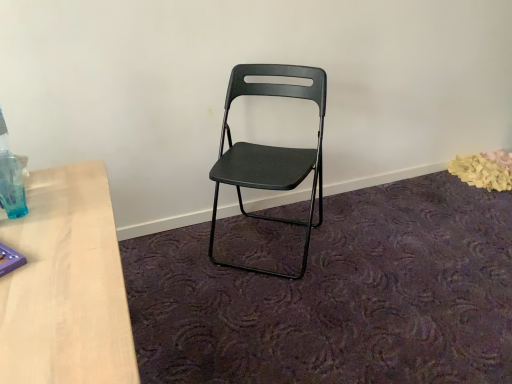
This screenshot has height=384, width=512. In order to click on vacant area situated below matte black folding chair at center (from a real-world perspective) in this screenshot , I will do `click(265, 246)`.